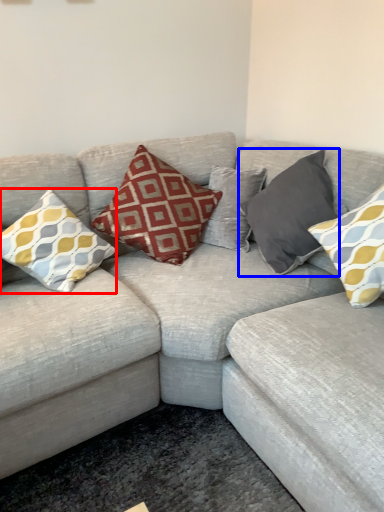
Question: Which object appears closest to the camera in this image, pillow (highlighted by a red box) or pillow (highlighted by a blue box)?

Choices:
 (A) pillow
 (B) pillow

Answer: (A)